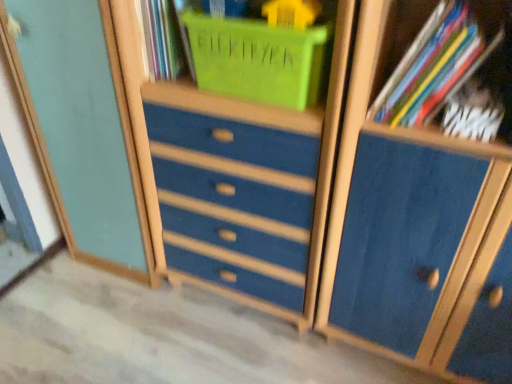
Question: Is blue painted wood dresser at center oriented towards multicolored paper at upper right, the second book in the bottom-to-top sequence?

Choices:
 (A) yes
 (B) no

Answer: (B)

Question: Can you confirm if blue painted wood dresser at center is shorter than multicolored paper at upper right, which is the 1th book in top-to-bottom order?

Choices:
 (A) no
 (B) yes

Answer: (A)

Question: Is blue painted wood dresser at center at the right side of multicolored paper at upper right, which is the 1th book in top-to-bottom order?

Choices:
 (A) yes
 (B) no

Answer: (B)

Question: Is blue painted wood dresser at center thinner than multicolored paper at upper right, the second book in the bottom-to-top sequence?

Choices:
 (A) yes
 (B) no

Answer: (B)

Question: Can you confirm if blue painted wood dresser at center is positioned to the left of multicolored paper at upper right, which is the 1th book in top-to-bottom order?

Choices:
 (A) yes
 (B) no

Answer: (A)

Question: In terms of size, does multicolored paper at upper right, the second book in the bottom-to-top sequence, appear bigger or smaller than white matte book at upper right, the 1th book from the bottom?

Choices:
 (A) small
 (B) big

Answer: (B)

Question: Is multicolored paper at upper right, the second book in the bottom-to-top sequence, wider or thinner than white matte book at upper right, which is counted as the second book, starting from the top?

Choices:
 (A) wide
 (B) thin

Answer: (A)

Question: Does point (408, 92) appear closer or farther from the camera than point (463, 84)?

Choices:
 (A) farther
 (B) closer

Answer: (B)

Question: Considering their positions, is multicolored paper at upper right, the second book in the bottom-to-top sequence, located in front of or behind white matte book at upper right, which is counted as the second book, starting from the top?

Choices:
 (A) behind
 (B) front

Answer: (B)

Question: Considering the positions of matte plastic basket at upper center and multicolored paper at upper right, which is the 1th book in top-to-bottom order, in the image, is matte plastic basket at upper center taller or shorter than multicolored paper at upper right, which is the 1th book in top-to-bottom order,?

Choices:
 (A) tall
 (B) short

Answer: (B)

Question: Looking at their shapes, would you say matte plastic basket at upper center is wider or thinner than multicolored paper at upper right, which is the 1th book in top-to-bottom order?

Choices:
 (A) wide
 (B) thin

Answer: (B)

Question: In the image, is matte plastic basket at upper center positioned in front of or behind multicolored paper at upper right, the second book in the bottom-to-top sequence?

Choices:
 (A) front
 (B) behind

Answer: (B)

Question: Looking at the image, does matte plastic basket at upper center seem bigger or smaller compared to multicolored paper at upper right, which is the 1th book in top-to-bottom order?

Choices:
 (A) small
 (B) big

Answer: (B)

Question: From the image's perspective, is multicolored paper at upper right, which is the 1th book in top-to-bottom order, above or below matte blue cabinet at left?

Choices:
 (A) below
 (B) above

Answer: (B)

Question: Considering the positions of multicolored paper at upper right, the second book in the bottom-to-top sequence, and matte blue cabinet at left in the image, is multicolored paper at upper right, the second book in the bottom-to-top sequence, wider or thinner than matte blue cabinet at left?

Choices:
 (A) thin
 (B) wide

Answer: (B)